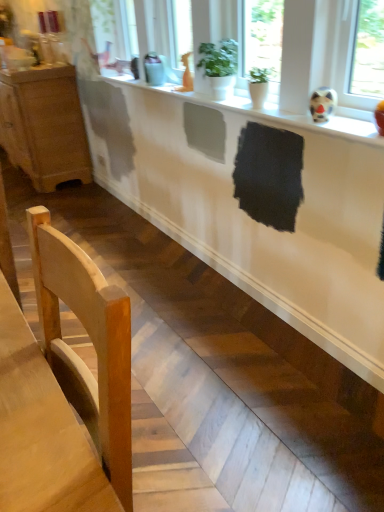
The height and width of the screenshot is (512, 384). Describe the element at coordinates (218, 67) in the screenshot. I see `green matte plant at upper center` at that location.

Locate an element on the screen. green matte plant at upper center is located at coordinates (218, 67).

Is light wood chair at lower left located within white glossy counter at lower center?

That's incorrect, light wood chair at lower left is not inside white glossy counter at lower center.

Is white glossy counter at lower center directly adjacent to light wood chair at lower left?

white glossy counter at lower center and light wood chair at lower left are not in contact.

From the image's perspective, is white glossy counter at lower center above or below light wood chair at lower left?

From the image's perspective, white glossy counter at lower center appears above light wood chair at lower left.

Which is more to the right, white matte counter top at upper center or white glossy counter at lower center?

white matte counter top at upper center.

From the image's perspective, is white matte counter top at upper center under white glossy counter at lower center?

No, from the image's perspective, white matte counter top at upper center is not beneath white glossy counter at lower center.

From a real-world perspective, is white matte counter top at upper center physically located above or below white glossy counter at lower center?

From a real-world perspective, white matte counter top at upper center is physically above white glossy counter at lower center.

Is white matte counter top at upper center in front of or behind white glossy counter at lower center in the image?

Visually, white matte counter top at upper center is located in front of white glossy counter at lower center.

Locate an element on the screen. Image resolution: width=384 pixels, height=512 pixels. chair in front of the white matte counter top at upper center is located at coordinates point(92,343).

How many degrees apart are the facing directions of light wood chair at lower left and white matte counter top at upper center?

4.87 degrees separate the facing orientations of light wood chair at lower left and white matte counter top at upper center.

Does light wood chair at lower left have a lesser height compared to white matte counter top at upper center?

No.

Can you see light wood chair at lower left touching white matte counter top at upper center?

No, light wood chair at lower left is not beside white matte counter top at upper center.

Between white matte counter top at upper center and wooden cabinet at left, which one has more height?

wooden cabinet at left.

Where is `counter top on the right of wooden cabinet at left`? counter top on the right of wooden cabinet at left is located at coordinates (271, 114).

From the image's perspective, which one is positioned higher, white matte counter top at upper center or wooden cabinet at left?

wooden cabinet at left is shown above in the image.

How far apart are wooden cabinet at left and white glossy counter at lower center?

wooden cabinet at left is 1.45 meters from white glossy counter at lower center.

The height and width of the screenshot is (512, 384). Identify the location of counter located in front of the wooden cabinet at left. (248, 215).

Considering the sizes of objects wooden cabinet at left and white glossy counter at lower center in the image provided, who is bigger, wooden cabinet at left or white glossy counter at lower center?

With larger size is wooden cabinet at left.

Is wooden cabinet at left in contact with white glossy counter at lower center?

wooden cabinet at left and white glossy counter at lower center are not in contact.

Based on the photo, is white glossy counter at lower center positioned before wooden cabinet at left?

Yes, it is.

In terms of height, does white glossy counter at lower center look taller or shorter compared to wooden cabinet at left?

In the image, white glossy counter at lower center appears to be shorter than wooden cabinet at left.

Between white glossy counter at lower center and wooden cabinet at left, which one has smaller width?

white glossy counter at lower center is thinner.

The width and height of the screenshot is (384, 512). Find the location of `cabinetry on the left side of white glossy counter at lower center`. cabinetry on the left side of white glossy counter at lower center is located at coordinates (44, 126).

Looking at this image, which object is closer to the camera, green matte plant at upper center or white glossy counter at lower center?

white glossy counter at lower center is closer to the camera.

From the image's perspective, which object appears higher, green matte plant at upper center or white glossy counter at lower center?

green matte plant at upper center appears higher in the image.

Which of these two, green matte plant at upper center or white glossy counter at lower center, is smaller?

green matte plant at upper center.

Locate an element on the screen. chair below the white glossy counter at lower center (from the image's perspective) is located at coordinates (92, 343).

Where is `counter top that appears above the white glossy counter at lower center (from a real-world perspective)`? counter top that appears above the white glossy counter at lower center (from a real-world perspective) is located at coordinates (271, 114).

Considering their positions, is white glossy counter at lower center positioned closer to green matte plant at upper center than white matte counter top at upper center?

Based on the image, white matte counter top at upper center appears to be nearer to green matte plant at upper center.

Which object lies further to the anchor point wooden cabinet at left, white glossy counter at lower center or white matte counter top at upper center?

The object further to wooden cabinet at left is white glossy counter at lower center.

Based on their spatial positions, is wooden cabinet at left or white matte counter top at upper center further from light wood chair at lower left?

wooden cabinet at left is positioned further to the anchor light wood chair at lower left.

Looking at the image, which one is located closer to white glossy counter at lower center, light wood chair at lower left or white matte counter top at upper center?

Based on the image, white matte counter top at upper center appears to be nearer to white glossy counter at lower center.

Estimate the real-world distances between objects in this image. Which object is closer to wooden cabinet at left, white matte counter top at upper center or light wood chair at lower left?

white matte counter top at upper center.

From the image, which object appears to be farther from light wood chair at lower left, white matte counter top at upper center or white glossy counter at lower center?

white glossy counter at lower center is positioned further to the anchor light wood chair at lower left.

Which object lies nearer to the anchor point light wood chair at lower left, green matte plant at upper center or wooden cabinet at left?

Among the two, green matte plant at upper center is located nearer to light wood chair at lower left.

Looking at the image, which one is located further to light wood chair at lower left, wooden cabinet at left or white glossy counter at lower center?

The object further to light wood chair at lower left is wooden cabinet at left.

Find the location of a particular element. The width and height of the screenshot is (384, 512). counter positioned between light wood chair at lower left and wooden cabinet at left from near to far is located at coordinates (248, 215).

Find the location of `counter top between green matte plant at upper center and light wood chair at lower left in the vertical direction`. counter top between green matte plant at upper center and light wood chair at lower left in the vertical direction is located at coordinates (271, 114).

Locate an element on the screen. This screenshot has height=512, width=384. houseplant located between light wood chair at lower left and wooden cabinet at left in the depth direction is located at coordinates (218, 67).

Identify the location of counter top between light wood chair at lower left and wooden cabinet at left in the front-back direction. The image size is (384, 512). 271,114.